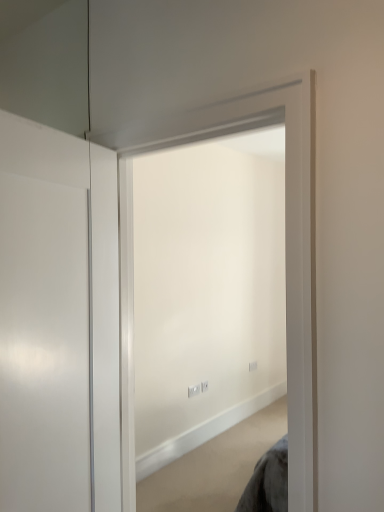
Question: Is white matte wall at center further to the viewer compared to white glossy door at left?

Choices:
 (A) yes
 (B) no

Answer: (A)

Question: Does white matte wall at center appear on the right side of white glossy door at left?

Choices:
 (A) yes
 (B) no

Answer: (A)

Question: Is white matte wall at center with white glossy door at left?

Choices:
 (A) no
 (B) yes

Answer: (A)

Question: Can you confirm if white matte wall at center is thinner than white glossy door at left?

Choices:
 (A) no
 (B) yes

Answer: (A)

Question: From a real-world perspective, is white matte wall at center physically above white glossy door at left?

Choices:
 (A) no
 (B) yes

Answer: (A)

Question: Is white matte wall at center facing towards white glossy door at left?

Choices:
 (A) no
 (B) yes

Answer: (B)

Question: From a real-world perspective, is white glossy door at left located higher than white matte wall at center?

Choices:
 (A) no
 (B) yes

Answer: (B)

Question: Is white glossy door at left facing away from white matte wall at center?

Choices:
 (A) yes
 (B) no

Answer: (B)

Question: Can you confirm if white glossy door at left is thinner than white matte wall at center?

Choices:
 (A) no
 (B) yes

Answer: (B)

Question: Would you say white glossy door at left is outside white matte wall at center?

Choices:
 (A) no
 (B) yes

Answer: (B)

Question: Could you tell me if white glossy door at left is turned towards white matte wall at center?

Choices:
 (A) yes
 (B) no

Answer: (A)

Question: Can you confirm if white glossy door at left is positioned to the left of white matte wall at center?

Choices:
 (A) no
 (B) yes

Answer: (B)

Question: Is white glossy door at left taller or shorter than white matte wall at center?

Choices:
 (A) tall
 (B) short

Answer: (B)